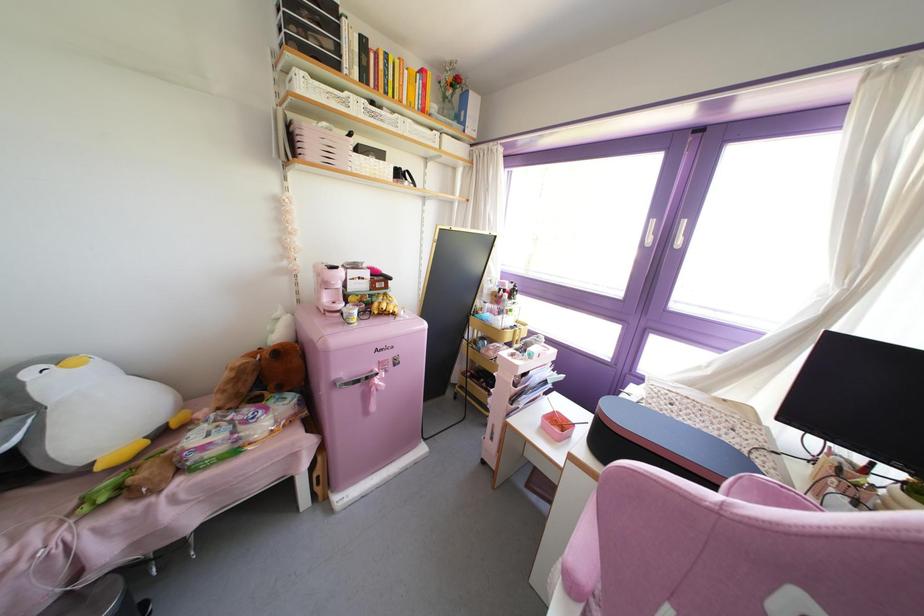
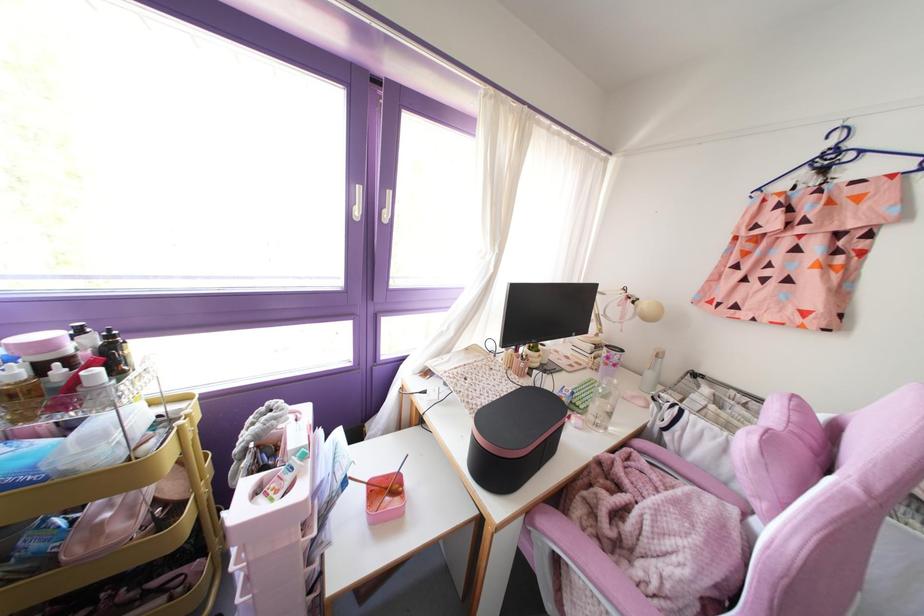
The images are taken continuously from a first-person perspective. In which direction is your viewpoint rotating?

The rotation direction of the camera is right-down.